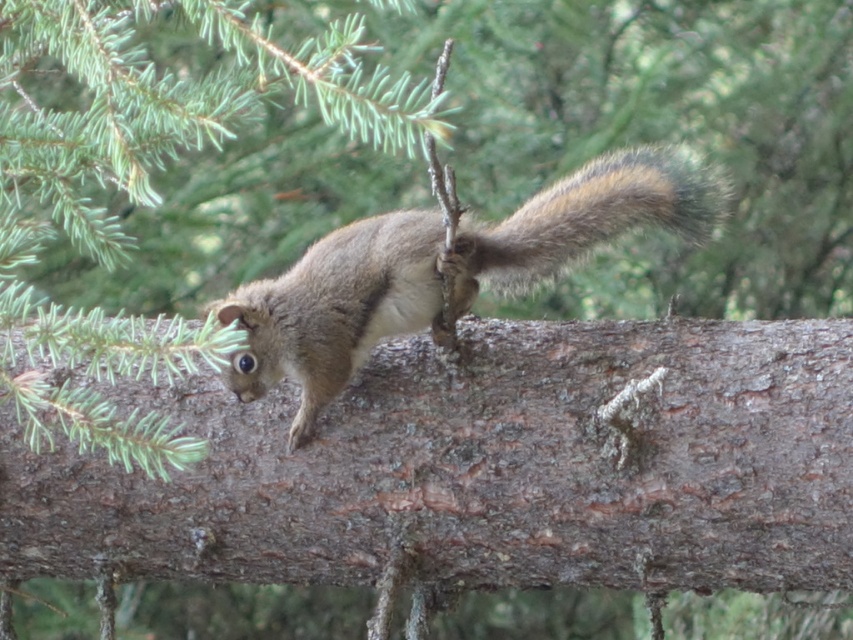
Question: Among these points, which one is farthest from the camera?

Choices:
 (A) (531, 208)
 (B) (663, 148)

Answer: (B)

Question: Which point appears farthest from the camera in this image?

Choices:
 (A) (434, 259)
 (B) (651, 177)

Answer: (B)

Question: Is brown fur squirrel at center smaller than fuzzy brown tail at center?

Choices:
 (A) yes
 (B) no

Answer: (B)

Question: Can you confirm if brown fur squirrel at center is positioned to the left of fuzzy brown tail at center?

Choices:
 (A) yes
 (B) no

Answer: (A)

Question: Which of the following is the farthest from the observer?

Choices:
 (A) brown fur squirrel at center
 (B) fuzzy brown tail at center

Answer: (B)

Question: Does brown fur squirrel at center appear under fuzzy brown tail at center?

Choices:
 (A) yes
 (B) no

Answer: (A)